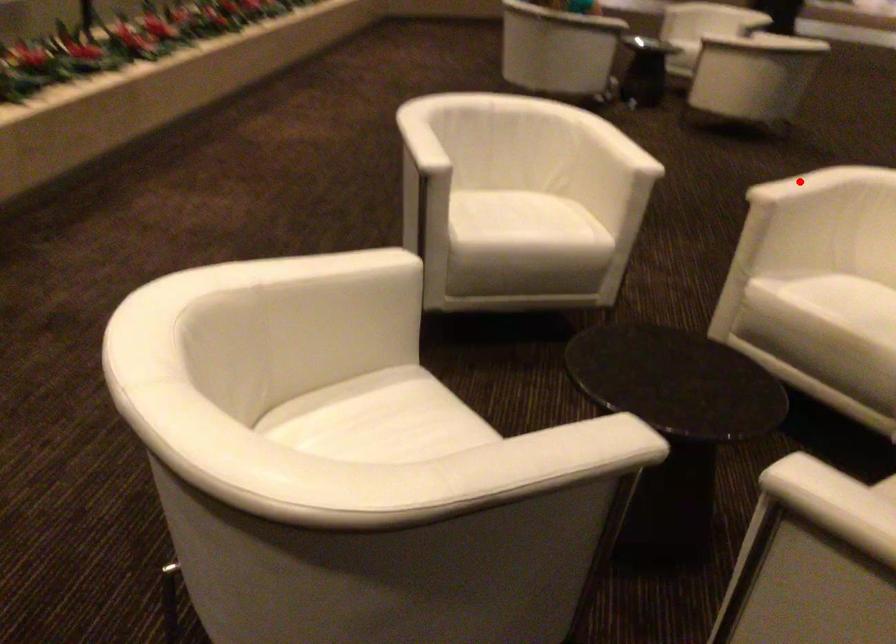
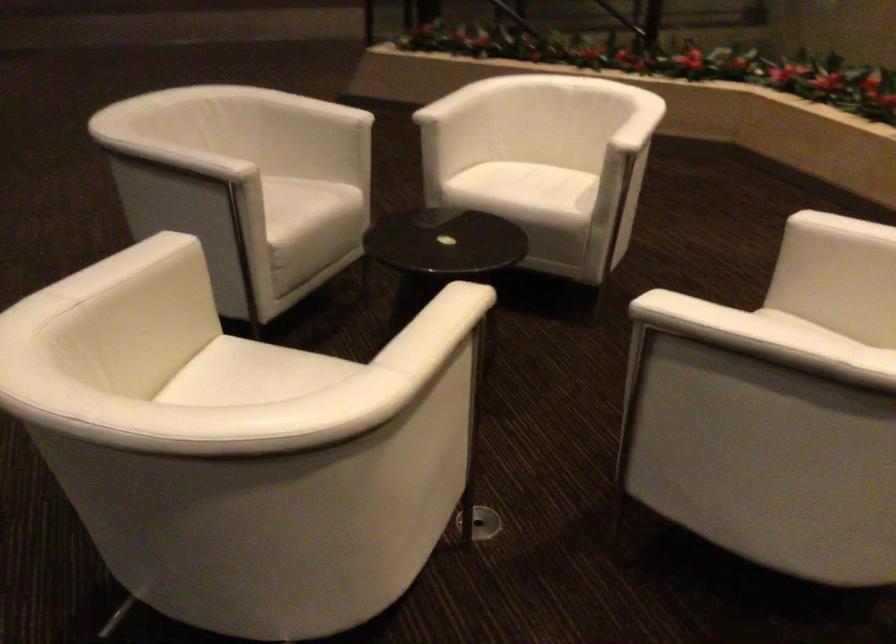
Question: I am providing you with two images of the same scene from different viewpoints. Image1 has a red point marked. In image2, the corresponding 3D location appears at what relative position? Reply with the corresponding letter.

Choices:
 (A) Closer
 (B) Farther

Answer: (A)